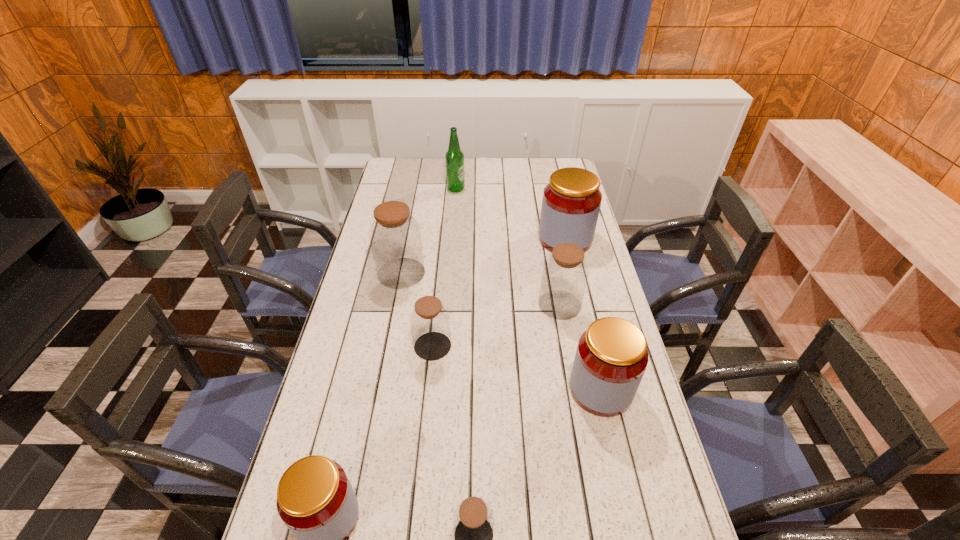
Identify which brown jar is the closest to the nearest red jar. Please provide its 2D coordinates. Your answer should be formatted as a tuple, i.e. [(x, y)], where the tuple contains the x and y coordinates of a point satisfying the conditions above.

[(473, 520)]

Find the location of a particular element. This screenshot has width=960, height=540. brown jar that can be found as the third closest to the second farthest object is located at coordinates (430, 324).

Identify the location of free spot that satisfies the following two spatial constraints: 1. on the label of the fifth farthest jar; 2. on the left side of the beer bottle. (442, 389).

At what (x,y) coordinates should I click in order to perform the action: click on vacant point that satisfies the following two spatial constraints: 1. on the label of the farthest object; 2. on the left side of the farthest jar. Please return your answer as a coordinate pair (x, y). Looking at the image, I should click on (452, 239).